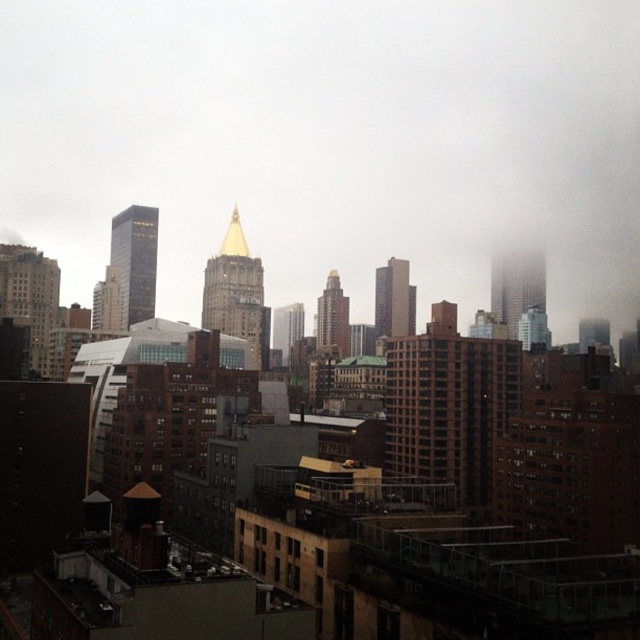
Question: Which of the following is the closest to the observer?

Choices:
 (A) (529, 307)
 (B) (20, 282)

Answer: (B)

Question: Which point is closer to the camera?

Choices:
 (A) transparent fog at center
 (B) gold polished spire at center
 (C) white fluffy cloud at upper left
 (D) glassy reflective skyscraper at center-left

Answer: (C)

Question: Is gold metallic tower at center to the right of smokey glass skyscraper at upper right from the viewer's perspective?

Choices:
 (A) no
 (B) yes

Answer: (A)

Question: Is smokey glass skyscraper at upper right to the right of matte glass skyscraper at upper center from the viewer's perspective?

Choices:
 (A) no
 (B) yes

Answer: (A)

Question: Which point is farther to the camera?

Choices:
 (A) (515, 300)
 (B) (20, 236)
 (C) (104, 282)
 (D) (140, 273)

Answer: (B)

Question: In this image, where is smooth glass skyscraper at center located relative to gold polished spire at center?

Choices:
 (A) above
 (B) below

Answer: (B)